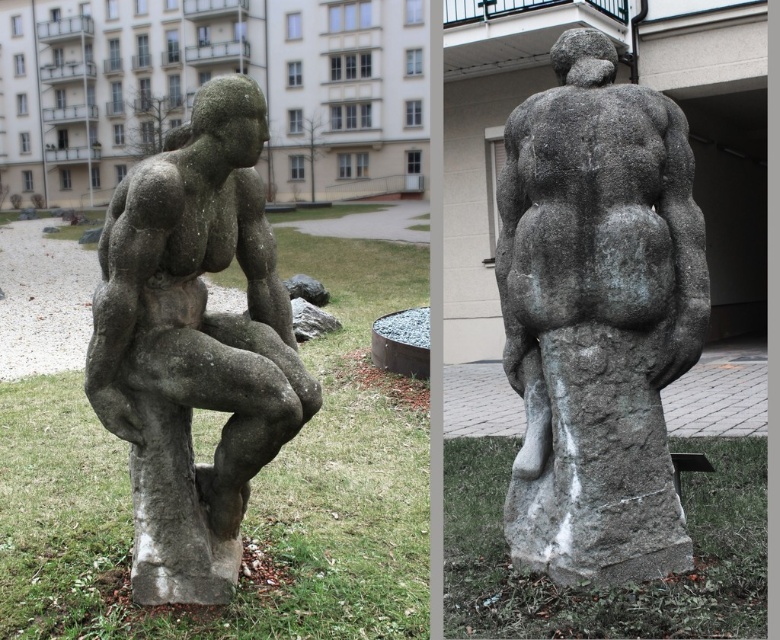
You are an art curator planning to move the gray stone statue at center and the gray stone statue at left to a new outdoor exhibition space. The new space has a narrow pathway between two walls that is only wide enough for one statue at a time. If you want to move both statues through this path, which statue should you move first to ensure they can both pass through without obstruction?

You should move the gray stone statue at left first, since it is positioned to the left of the gray stone statue at center in the original image. This means the gray stone statue at left is closer to the starting point of the pathway, allowing it to be moved first without blocking the path for the other statue.

You are an art curator planning to move the gray stone statue at center and the gray stone statue at left to a new outdoor exhibition space. The new space has a height restriction of 3 meters. Based on their positions in the current image, can both statues be moved without exceeding the height limit?

The gray stone statue at center is above the gray stone statue at left, but without specific height measurements, it is impossible to determine if both statues comply with the 3 meter height restriction. Additional information about their actual heights is needed.